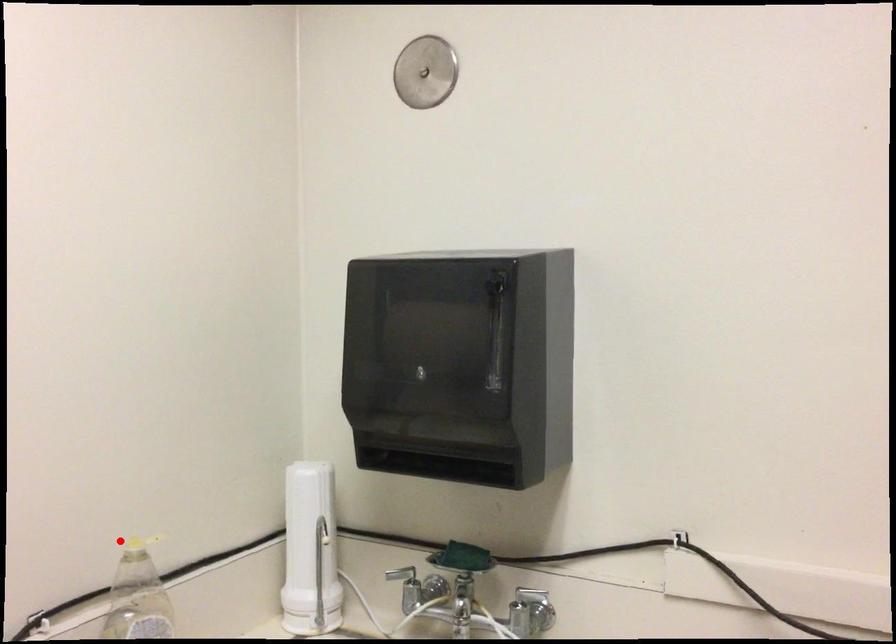
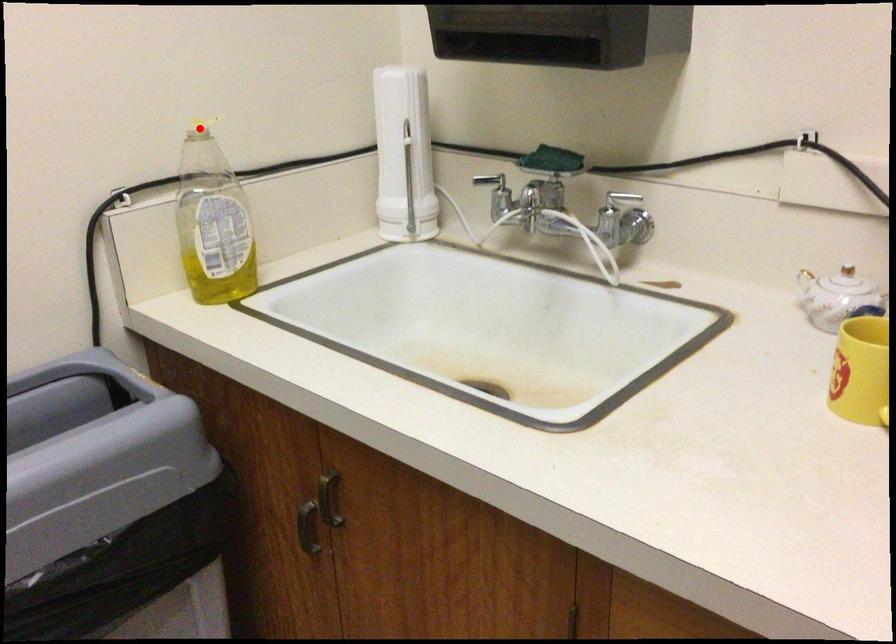
I am providing you with two images of the same scene from different viewpoints. A red point is marked on the first image and another point is marked on the second image. Does the point marked in image1 correspond to the same location as the one in image2?

Yes